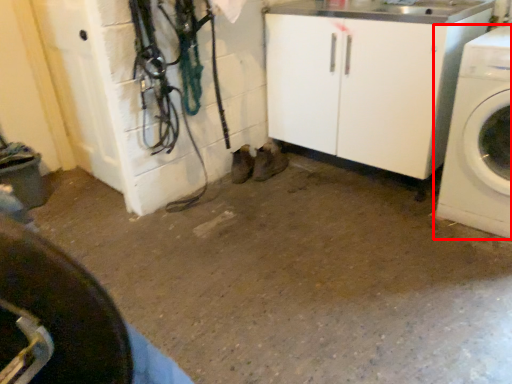
Question: In this image, where is washing machine (annotated by the red box) located relative to tire?

Choices:
 (A) right
 (B) left

Answer: (A)